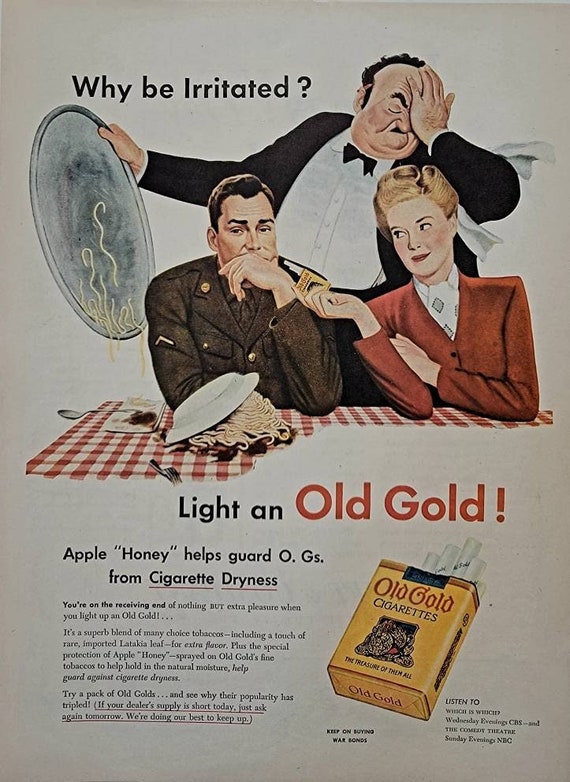
This screenshot has width=570, height=782. In order to click on the bottom of white plate in this screenshot , I will do `click(205, 389)`.